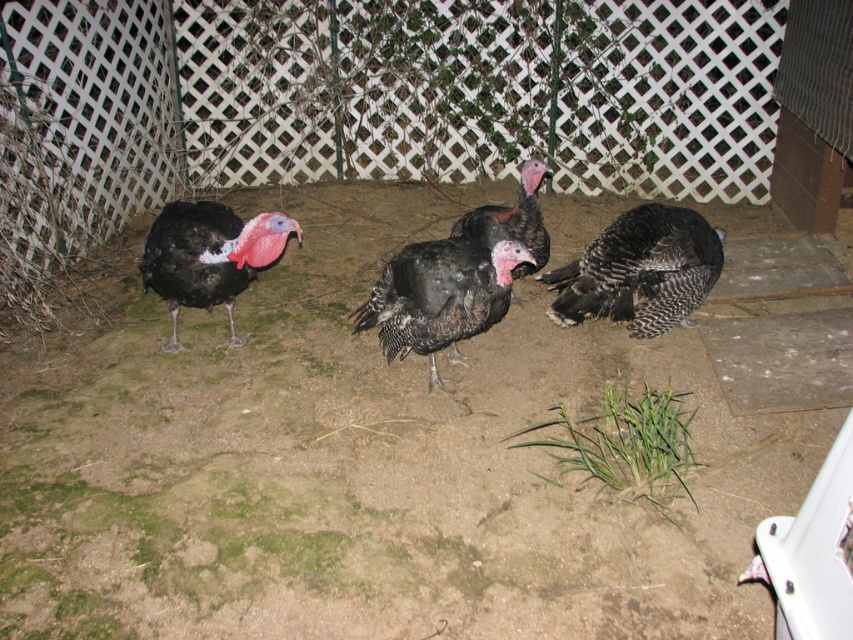
You are a birdwatcher observing the turkeys. You notice two turkeys in the scene. Which one has a shorter height between the black textured feathers at center and the matte black turkey at left?

The black textured feathers at center is shorter than the matte black turkey at left.

In the scene shown: You are a birdwatcher observing the turkeys. You notice the black textured feathers at center and the matte black turkey at left. Which object is lower in the image?

The black textured feathers at center is below matte black turkey at left, so the black textured feathers at center is lower in the image.

You are a turkey enthusiast observing the scene. You notice the white lattice fence at upper center and the black feathered turkey at center. Which object is positioned higher in the image?

The white lattice fence at upper center is positioned higher than the black feathered turkey at center in the image.